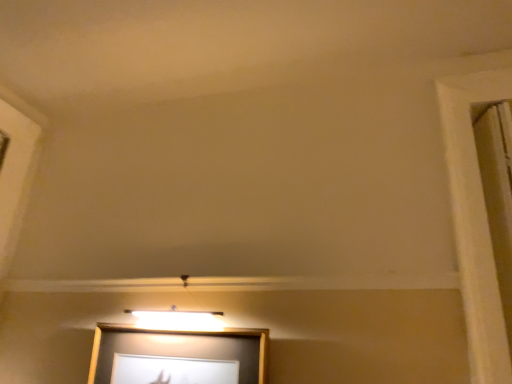
Question: Does wooden picture frame at center have a greater height compared to white wood window frame at right?

Choices:
 (A) yes
 (B) no

Answer: (B)

Question: Does wooden picture frame at center have a greater width compared to white wood window frame at right?

Choices:
 (A) yes
 (B) no

Answer: (A)

Question: From a real-world perspective, is wooden picture frame at center over white wood window frame at right?

Choices:
 (A) no
 (B) yes

Answer: (A)

Question: Is wooden picture frame at center positioned beyond the bounds of white wood window frame at right?

Choices:
 (A) no
 (B) yes

Answer: (B)

Question: Is wooden picture frame at center shorter than white wood window frame at right?

Choices:
 (A) no
 (B) yes

Answer: (B)

Question: Is wooden picture frame at center not close to white wood window frame at right?

Choices:
 (A) yes
 (B) no

Answer: (B)

Question: Considering the relative positions of white wood window frame at right and wooden picture frame at center in the image provided, is white wood window frame at right behind wooden picture frame at center?

Choices:
 (A) yes
 (B) no

Answer: (B)

Question: Does white wood window frame at right have a greater height compared to wooden picture frame at center?

Choices:
 (A) no
 (B) yes

Answer: (B)

Question: Can you confirm if white wood window frame at right is positioned to the right of wooden picture frame at center?

Choices:
 (A) no
 (B) yes

Answer: (B)

Question: Is white wood window frame at right turned away from wooden picture frame at center?

Choices:
 (A) no
 (B) yes

Answer: (A)

Question: Is the position of white wood window frame at right less distant than that of wooden picture frame at center?

Choices:
 (A) no
 (B) yes

Answer: (B)

Question: Is white wood window frame at right bigger than wooden picture frame at center?

Choices:
 (A) yes
 (B) no

Answer: (B)

Question: From their relative heights in the image, would you say white wood window frame at right is taller or shorter than wooden picture frame at center?

Choices:
 (A) short
 (B) tall

Answer: (B)